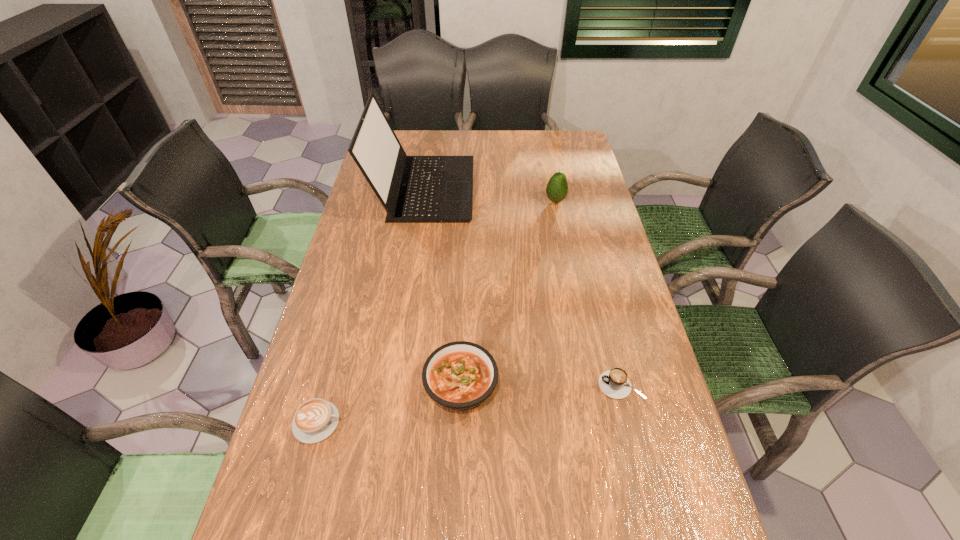
In order to click on free space located 0.200m with the handle on the side of the taller cappuccino in this screenshot , I will do `click(516, 385)`.

Identify the location of vacant region located with the handle on the side of the taller cappuccino. (445, 385).

This screenshot has width=960, height=540. Find the location of `vacant space situated with the handle on the side of the taller cappuccino`. vacant space situated with the handle on the side of the taller cappuccino is located at coordinates (562, 385).

Image resolution: width=960 pixels, height=540 pixels. In order to click on vacant space located 0.380m on the side of the left cappuccino with the handle in this screenshot , I will do `click(509, 422)`.

Locate an element on the screen. The width and height of the screenshot is (960, 540). object located at the far edge is located at coordinates (413, 189).

Locate an element on the screen. laptop present at the left edge is located at coordinates (413, 189).

Identify the location of cappuccino present at the left edge. This screenshot has height=540, width=960. (316, 419).

At what (x,y) coordinates should I click in order to perform the action: click on avocado that is at the right edge. Please return your answer as a coordinate pair (x, y). Looking at the image, I should click on (557, 187).

I want to click on cappuccino at the right edge, so click(614, 383).

You are a GUI agent. You are given a task and a screenshot of the screen. Output one action in this format:
    pyautogui.click(x=<x>, y=<y>)
    Task: Click on the object that is positioned at the far left corner
    The image size is (960, 540).
    Given the screenshot: What is the action you would take?
    [x=413, y=189]